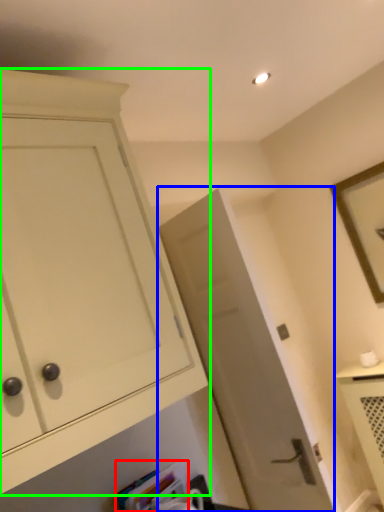
Question: Based on their relative distances, which object is nearer to book (highlighted by a red box)? Choose from door (highlighted by a blue box) and cabinetry (highlighted by a green box).

Choices:
 (A) door
 (B) cabinetry

Answer: (A)